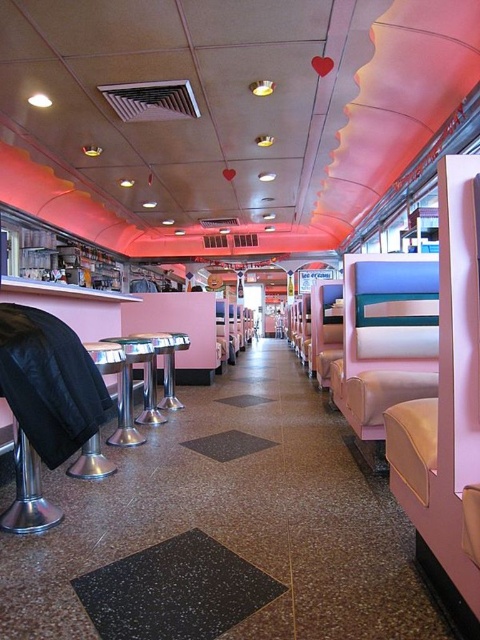
Which of these two, black leather stool at lower left or metallic silver table at center, stands shorter?

black leather stool at lower left

In the scene shown: Is black leather stool at lower left behind metallic silver table at center?

No.

Locate an element on the screen. This screenshot has height=640, width=480. black leather stool at lower left is located at coordinates (45, 404).

This screenshot has width=480, height=640. I want to click on black leather stool at lower left, so click(x=45, y=404).

Is point (128, 429) farther from camera compared to point (97, 456)?

Yes, it is.

Is metallic silver table at center smaller than metallic silver table at lower left?

No.

Which is in front, point (127, 380) or point (94, 356)?

Point (94, 356) is more forward.

The image size is (480, 640). I want to click on metallic silver table at center, so click(128, 390).

Can you confirm if metallic silver table at lower left is thinner than silver metallic bar stool at center?

Yes, metallic silver table at lower left is thinner than silver metallic bar stool at center.

Which is more to the right, metallic silver table at lower left or silver metallic bar stool at center?

silver metallic bar stool at center

This screenshot has height=640, width=480. Find the location of `metallic silver table at lower left`. metallic silver table at lower left is located at coordinates (92, 461).

Where is `metallic silver table at lower left`? metallic silver table at lower left is located at coordinates (92, 461).